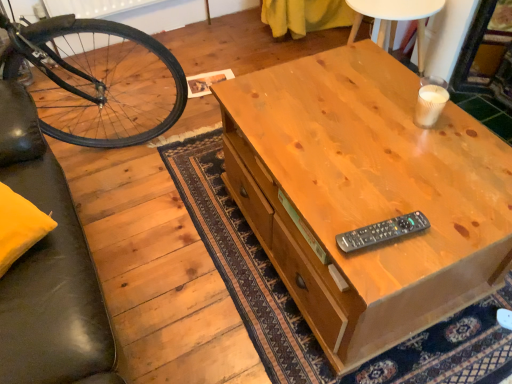
The image size is (512, 384). Identify the location of black plastic remote at center. (382, 232).

The image size is (512, 384). Describe the element at coordinates (430, 104) in the screenshot. I see `white paper cup at upper right` at that location.

The image size is (512, 384). Find the location of `light brown wood desk at center`. light brown wood desk at center is located at coordinates (366, 195).

Based on the photo, which of these two, white paper cup at upper right or light brown wood desk at center, is thinner?

Thinner between the two is white paper cup at upper right.

From the image's perspective, who appears lower, white paper cup at upper right or light brown wood desk at center?

light brown wood desk at center.

From the image's perspective, between light brown wood desk at center and white paper cup at upper right, who is located below?

light brown wood desk at center is shown below in the image.

Considering the relative sizes of light brown wood desk at center and white paper cup at upper right in the image provided, is light brown wood desk at center thinner than white paper cup at upper right?

No.

Between light brown wood desk at center and white paper cup at upper right, which one has smaller size?

white paper cup at upper right.

Which object is further away from the camera, black plastic remote at center or white paper cup at upper right?

Positioned behind is white paper cup at upper right.

Which of these two, black plastic remote at center or white paper cup at upper right, is bigger?

white paper cup at upper right is bigger.

Consider the image. Considering the sizes of objects black plastic remote at center and white paper cup at upper right in the image provided, who is thinner, black plastic remote at center or white paper cup at upper right?

Thinner between the two is white paper cup at upper right.

Is point (379, 226) closer or farther from the camera than point (426, 99)?

Clearly, point (379, 226) is closer to the camera than point (426, 99).

From a real-world perspective, does white paper cup at upper right stand above black plastic remote at center?

Yes, from a real-world perspective, white paper cup at upper right is on top of black plastic remote at center.

How many degrees apart are the facing directions of white paper cup at upper right and black plastic remote at center?

white paper cup at upper right and black plastic remote at center are facing 175 degrees away from each other.

Image resolution: width=512 pixels, height=384 pixels. What are the coordinates of `coffee cup lying above the black plastic remote at center (from the image's perspective)` in the screenshot? It's located at pos(430,104).

Can you confirm if white paper cup at upper right is positioned to the left of black plastic remote at center?

In fact, white paper cup at upper right is to the right of black plastic remote at center.

From a real-world perspective, does black plastic remote at center sit lower than light brown wood desk at center?

Result: Actually, black plastic remote at center is physically above light brown wood desk at center in the real world.

Considering the sizes of black plastic remote at center and light brown wood desk at center in the image, is black plastic remote at center wider or thinner than light brown wood desk at center?

black plastic remote at center is thinner than light brown wood desk at center.

Looking at the image, does black plastic remote at center seem bigger or smaller compared to light brown wood desk at center?

Clearly, black plastic remote at center is smaller in size than light brown wood desk at center.

How different are the orientations of light brown wood desk at center and black plastic remote at center in degrees?

There is a 82.8-degree angle between the facing directions of light brown wood desk at center and black plastic remote at center.

Is the position of light brown wood desk at center less distant than that of black plastic remote at center?

Yes, it is in front of black plastic remote at center.

Is light brown wood desk at center shorter than black plastic remote at center?

No.

From a real-world perspective, which is physically above, light brown wood desk at center or black plastic remote at center?

black plastic remote at center, from a real-world perspective.

Image resolution: width=512 pixels, height=384 pixels. Find the location of `desk that is below the white paper cup at upper right (from the image's perspective)`. desk that is below the white paper cup at upper right (from the image's perspective) is located at coordinates (366, 195).

I want to click on desk in front of the white paper cup at upper right, so click(x=366, y=195).

From the image, which object appears to be nearer to light brown wood desk at center, white paper cup at upper right or black plastic remote at center?

The object closer to light brown wood desk at center is black plastic remote at center.

Based on their spatial positions, is white paper cup at upper right or light brown wood desk at center closer to black plastic remote at center?

Among the two, light brown wood desk at center is located nearer to black plastic remote at center.

When comparing their distances from white paper cup at upper right, does black plastic remote at center or light brown wood desk at center seem further?

black plastic remote at center is further to white paper cup at upper right.

Based on their spatial positions, is black plastic remote at center or white paper cup at upper right further from light brown wood desk at center?

Based on the image, white paper cup at upper right appears to be further to light brown wood desk at center.

Estimate the real-world distances between objects in this image. Which object is further from white paper cup at upper right, light brown wood desk at center or black plastic remote at center?

black plastic remote at center.

When comparing their distances from black plastic remote at center, does light brown wood desk at center or white paper cup at upper right seem further?

Among the two, white paper cup at upper right is located further to black plastic remote at center.

This screenshot has width=512, height=384. In order to click on desk between white paper cup at upper right and black plastic remote at center in the up-down direction in this screenshot , I will do `click(366, 195)`.